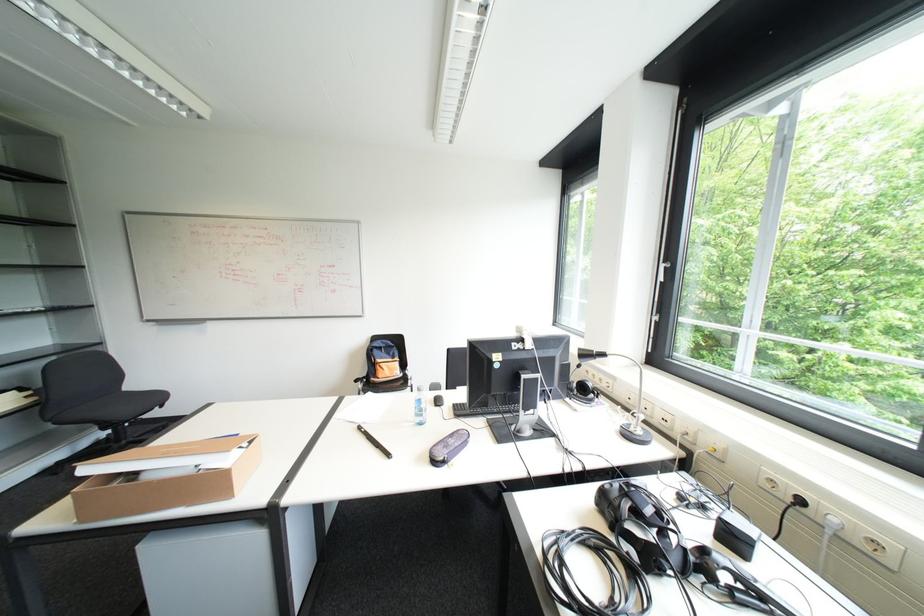
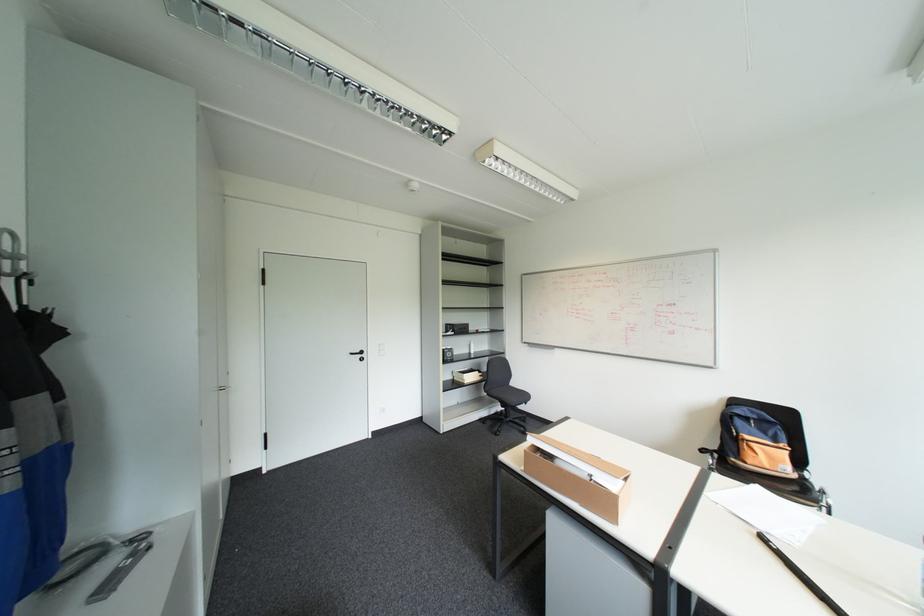
Find the pixel in the second image that matches pixel 414 363 in the first image.

(808, 460)